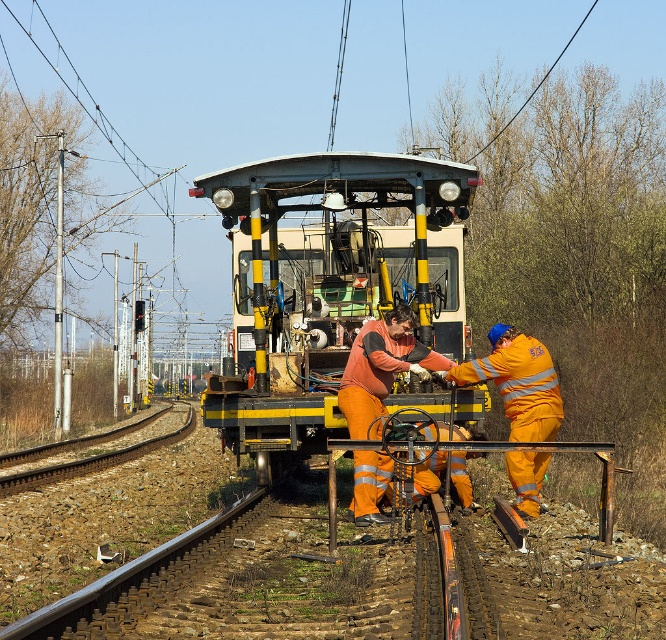
Can you confirm if metallic yellow train at center is positioned to the right of orange reflective rail at center?

No, metallic yellow train at center is not to the right of orange reflective rail at center.

Is point (284, 182) farther from viewer compared to point (509, 452)?

Yes, point (284, 182) is behind point (509, 452).

You are a GUI agent. You are given a task and a screenshot of the screen. Output one action in this format:
    pyautogui.click(x=<x>, y=<y>)
    Task: Click on the metallic yellow train at center
    
    Given the screenshot: What is the action you would take?
    pyautogui.click(x=324, y=284)